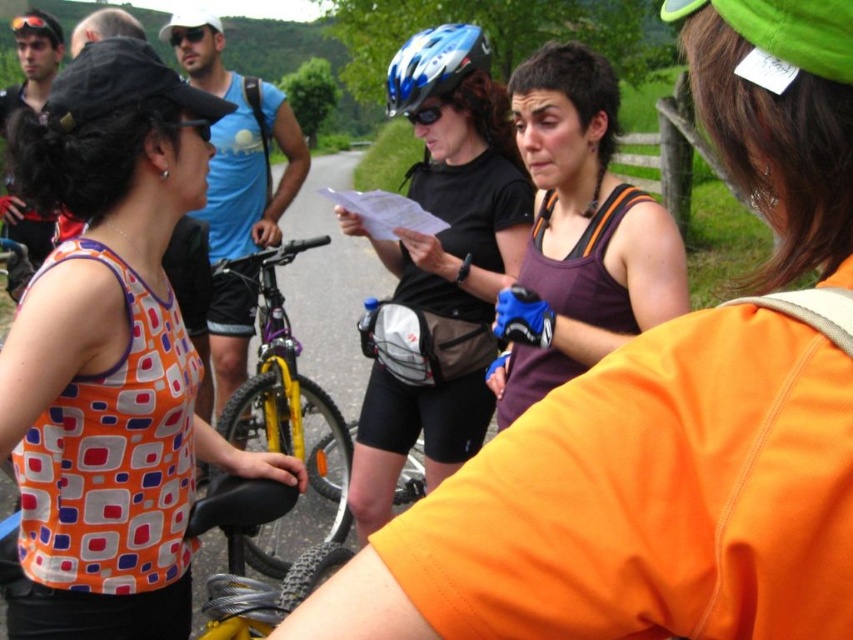
Question: Can you confirm if matte black tank top at center is wider than yellow metallic bicycle at center?

Choices:
 (A) no
 (B) yes

Answer: (A)

Question: Does orange printed tank top at left appear on the right side of blue glossy bicycle helmet at center?

Choices:
 (A) yes
 (B) no

Answer: (B)

Question: Considering the real-world distances, which object is farthest from the matte black tank top at center?

Choices:
 (A) blue glossy bicycle helmet at center
 (B) orange printed tank top at left

Answer: (A)

Question: Observing the image, what is the correct spatial positioning of purple fabric tank top at center in reference to yellow metallic bicycle at center?

Choices:
 (A) right
 (B) left

Answer: (A)

Question: Which point is farther to the camera?

Choices:
 (A) matte black tank top at center
 (B) yellow metallic bicycle at center
 (C) orange printed tank top at left
 (D) purple fabric tank top at center

Answer: (D)

Question: Based on their relative distances, which object is farther from the matte black tank top at center?

Choices:
 (A) purple fabric tank top at center
 (B) yellow metallic bicycle at center

Answer: (B)